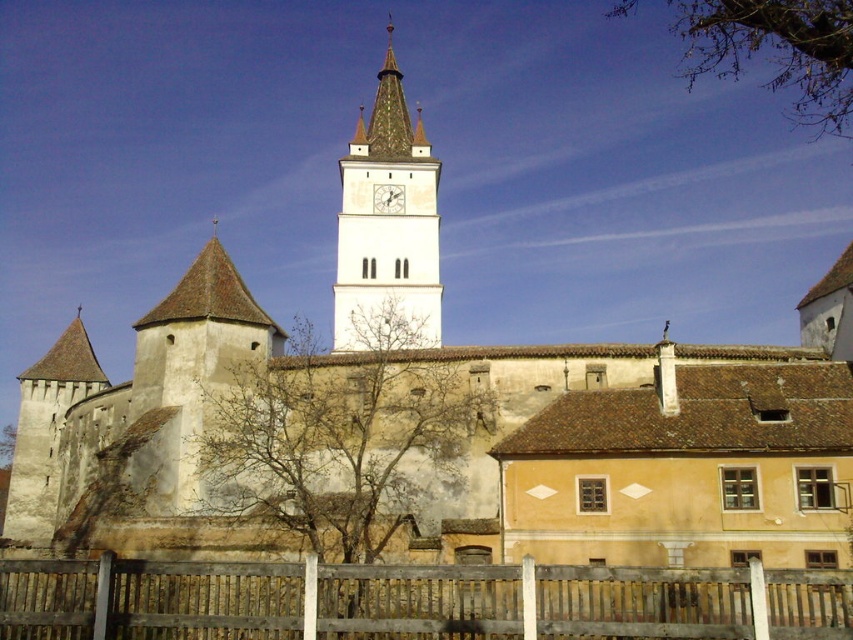
You are a bird flying over the historic building complex. You want to land on the bare branches at center. Where should you aim to land?

You should aim to land at point (339, 436) to reach the bare branches at center.

You are standing at the center of the image. Which direction should you look to see the white stone clock tower at center?

The white stone clock tower at center is located at the center of the image, so you should look straight ahead to see it.

You are standing at the camera position and want to take a photo of the white stone clock tower at center. If your camera can capture objects up to 100 meters away, will you be able to capture the entire tower in the photo?

The white stone clock tower at center and camera are 88.48 meters apart from each other, which is within the camera range of 100 meters. Therefore, the camera can capture the entire tower in the photo.